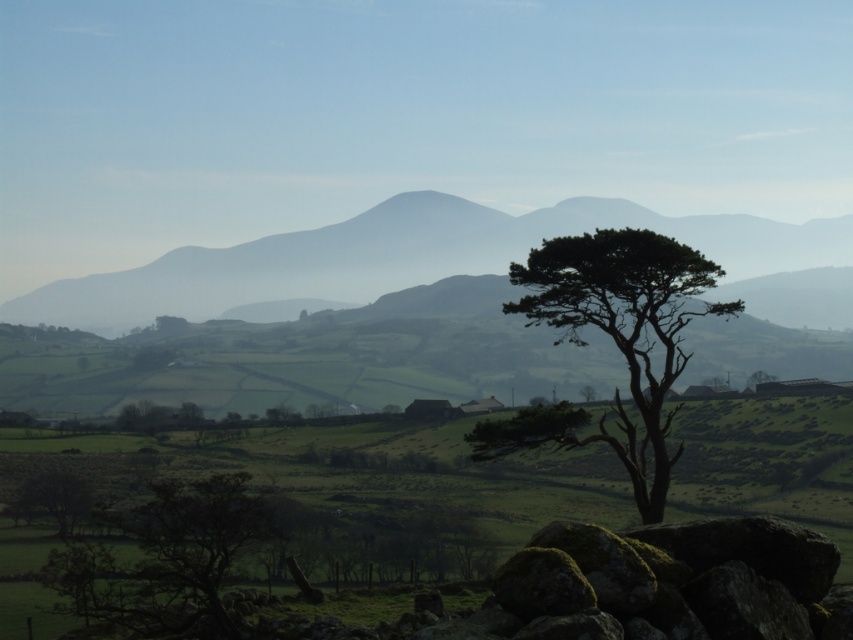
You are a hiker planning to take a photo of the silvery gray mountain at center and the green leafy tree at lower left from a vantage point that allows both to be in the frame. Considering their sizes, which object will appear larger in the photo?

The silvery gray mountain at center will appear larger in the photo because it is much taller than the green leafy tree at lower left.

You are a landscape painter planning to sketch the scene. You need to decide which object to draw first based on their sizes. Which one should you start with, the silvery gray mountain at center or the green leafy tree at lower left?

The silvery gray mountain at center is bigger than the green leafy tree at lower left, so you should start with the silvery gray mountain at center as it requires more space and detail.

From the picture: You are standing at point A with coordinates point A at (550, 246). You want to walk to point B which is 43.72 meters away. Is there any obstacle between you and point B?

The points are 43.72 meters apart. The scene has rocks in the foreground and rolling hills in the midground, but no specific obstacles mentioned between them. Assuming a clear path, you can proceed.